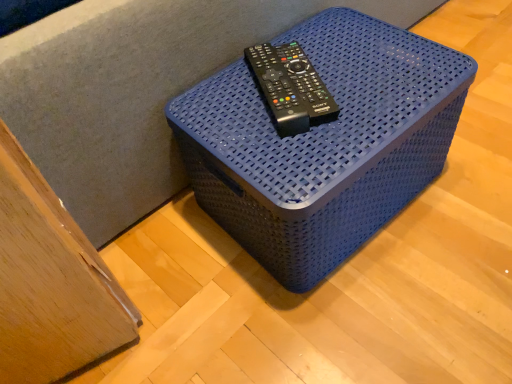
Locate an element on the screen. vacant space situated on the left part of black plastic remote control at center is located at coordinates (212, 96).